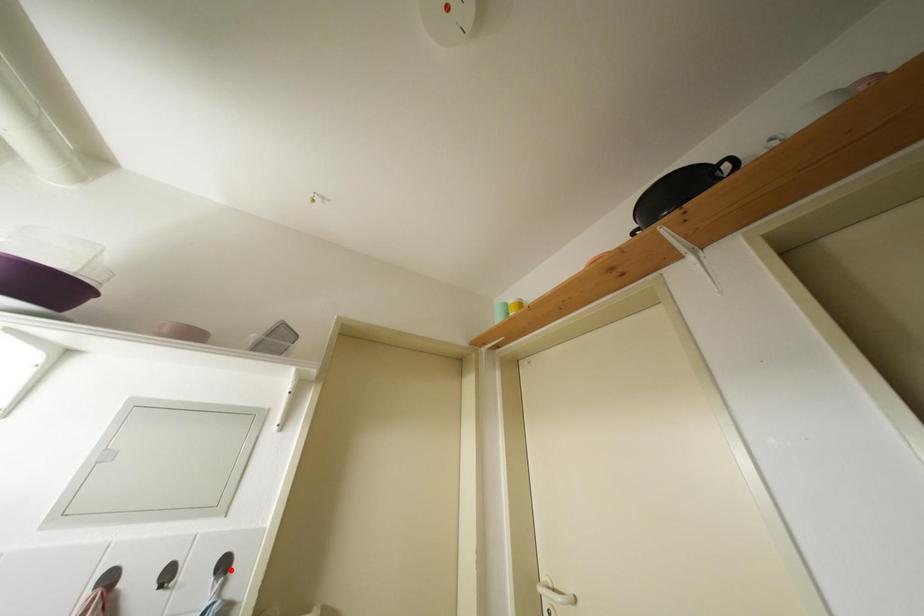
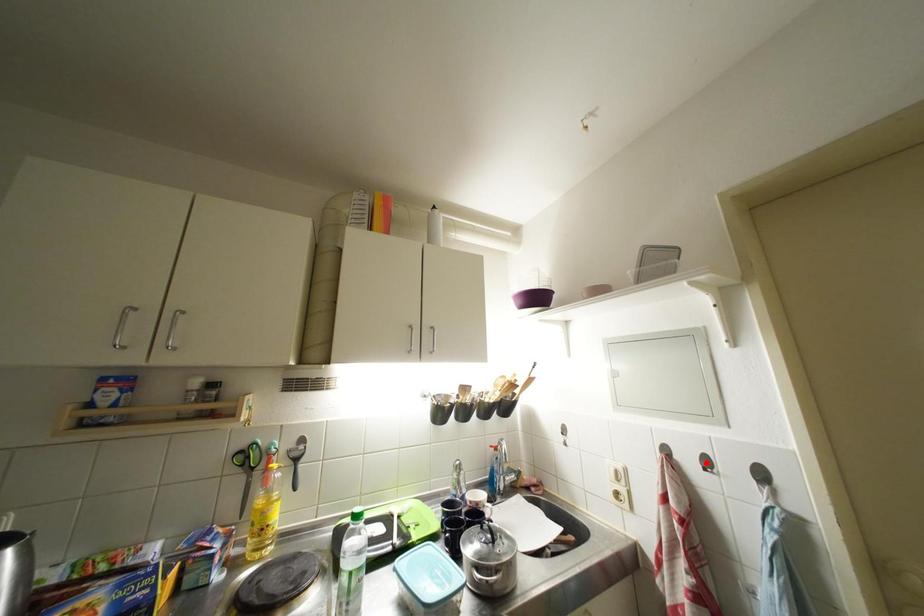
I am providing you with two images of the same scene from different viewpoints. A red point is marked on the first image and another point is marked on the second image. Does the point marked in image1 correspond to the same location as the one in image2?

No